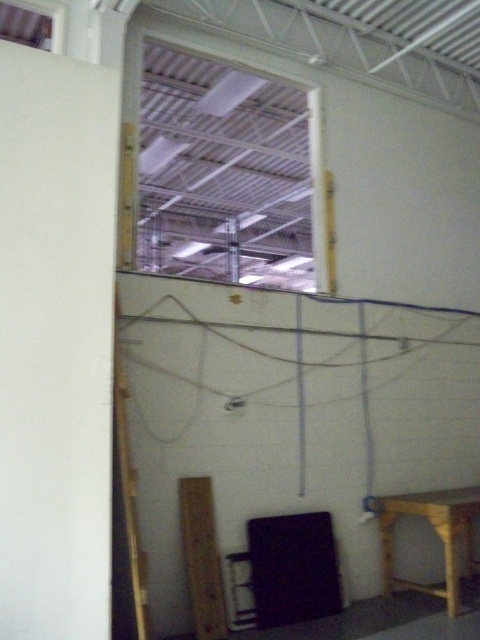
You are an inspector checking the warehouse. You need to place a 1.2 meter wide equipment between the wooden stool at lower right and the black plastic stool at lower center. Can you fit it there?

The wooden stool at lower right is bigger than the black plastic stool at lower center, but the distance between them isn not specified in the objects description. Therefore, it is unclear if the 1.2 meter wide equipment can fit between them.

You are an inspector in the warehouse and need to access the cables on the wall. You have two stools available, the wooden stool at lower right and the black plastic stool at lower center. Which stool should you move to reach the cables?

The black plastic stool at lower center is behind the wooden stool at lower right, so you should move the wooden stool at lower right to access the cables.

You are an inspector checking the warehouse. You see a wooden stool at lower right and a wooden at left. Which one is shorter?

The wooden stool at lower right is not as tall as wooden at left, so the wooden stool at lower right is shorter.